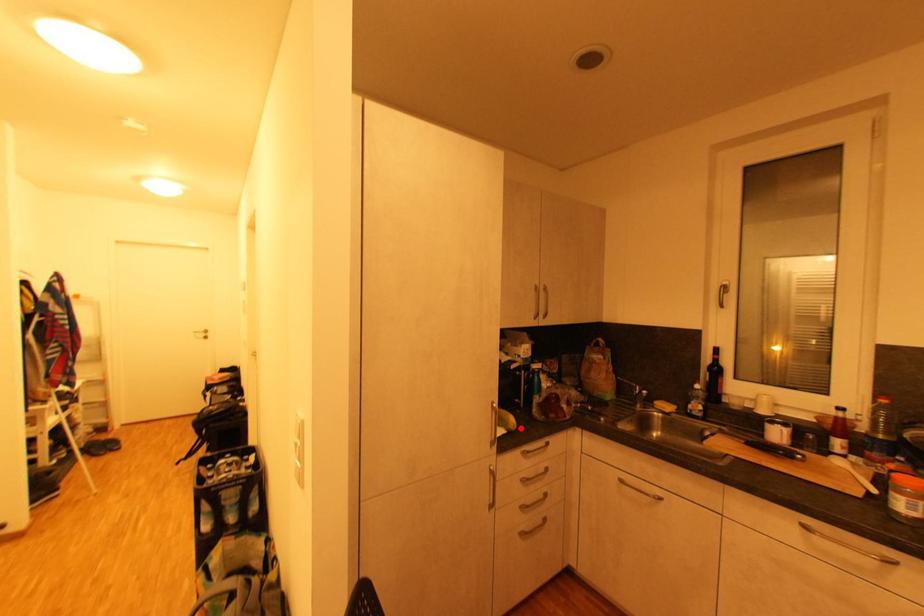
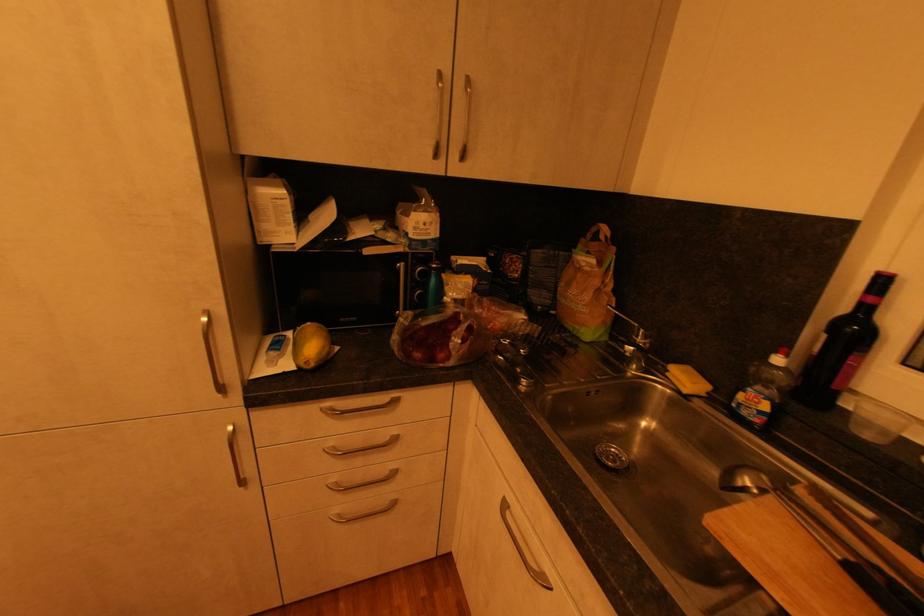
Where in the second image is the point corresponding to the highlighted location from the first image?

(317, 365)